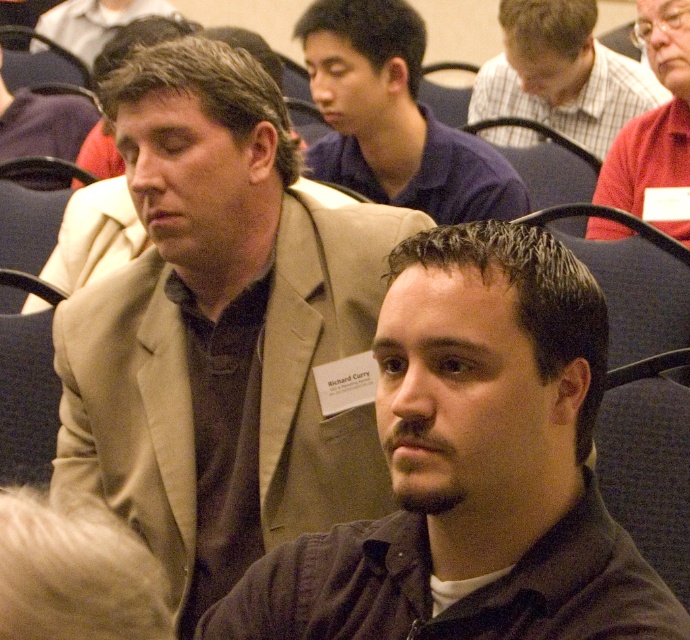
Question: Estimate the real-world distances between objects in this image. Which object is farther from the matte brown suit at center?

Choices:
 (A) plaid shirt at upper center
 (B) beige suit jacket at center
 (C) red shirt at upper right
 (D) matte black suit at upper left

Answer: (B)

Question: Is dark brown shirt at center below matte black suit at upper left?

Choices:
 (A) no
 (B) yes

Answer: (B)

Question: Which point appears closest to the camera in this image?

Choices:
 (A) (135, 0)
 (B) (364, 93)
 (C) (515, 19)
 (D) (68, 120)

Answer: (B)

Question: Can you confirm if beige suit jacket at center is smaller than matte brown suit at center?

Choices:
 (A) no
 (B) yes

Answer: (B)

Question: Observing the image, what is the correct spatial positioning of beige suit jacket at center in reference to dark brown shirt at center?

Choices:
 (A) left
 (B) right

Answer: (A)

Question: Which point is closer to the camera?

Choices:
 (A) beige suit jacket at center
 (B) matte black suit at upper left
 (C) plaid shirt at upper center

Answer: (A)